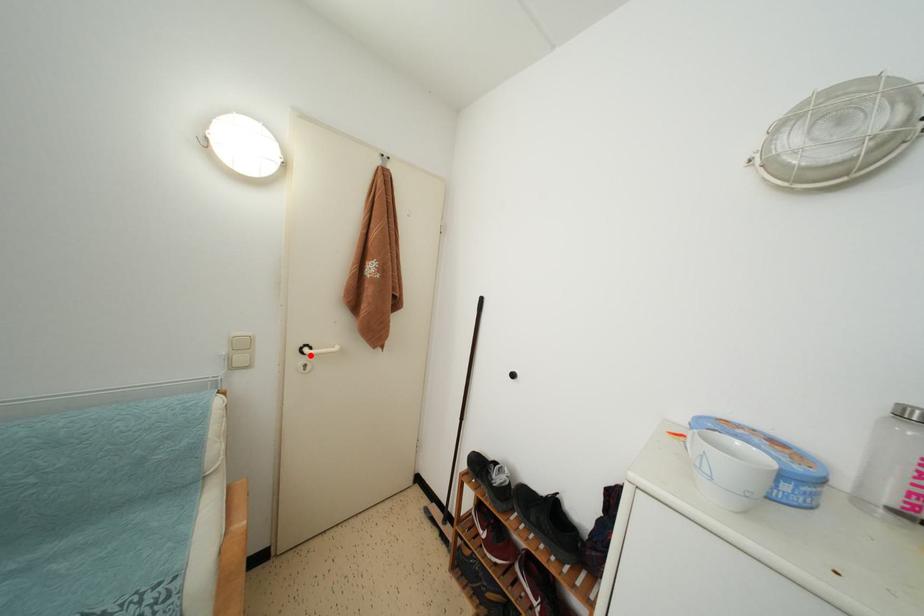
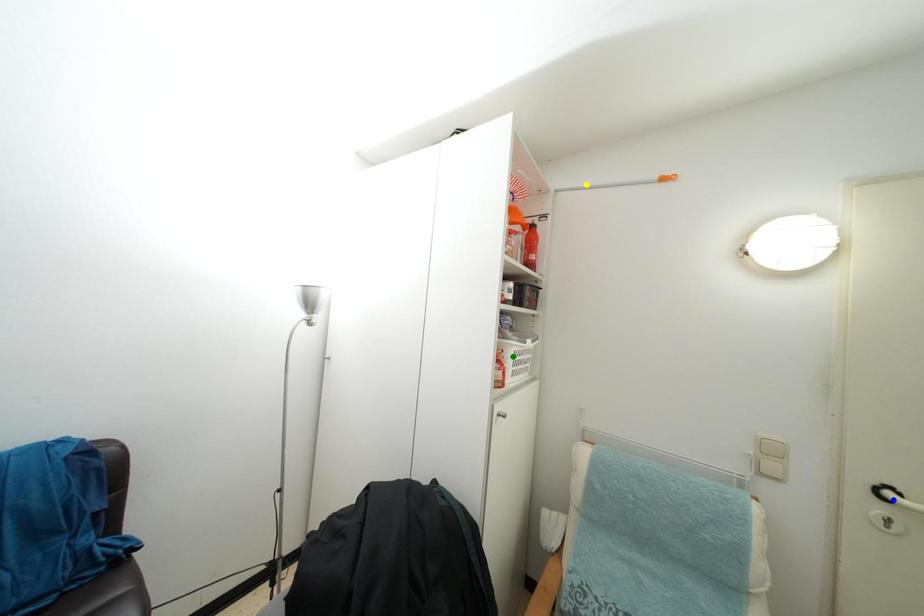
Question: I am providing you with two images of the same scene from different viewpoints. A red point is marked on the first image. You are given multiple points on the second image. Which spot in image 2 lines up with the point in image 1?

Choices:
 (A) green point
 (B) blue point
 (C) yellow point

Answer: (B)